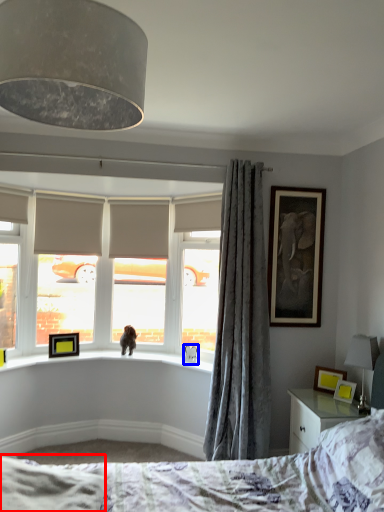
Question: Which point is further to the camera, sheet (highlighted by a red box) or animal (highlighted by a blue box)?

Choices:
 (A) sheet
 (B) animal

Answer: (B)